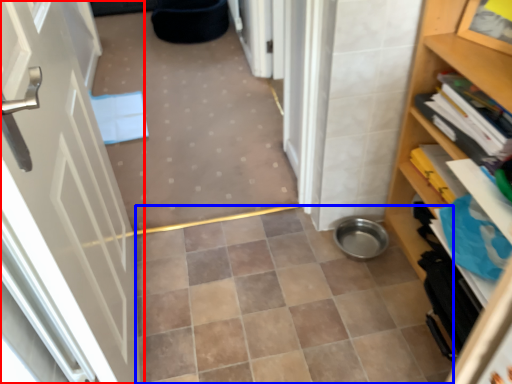
Question: Which object is further to the camera taking this photo, door (highlighted by a red box) or ceramic tile (highlighted by a blue box)?

Choices:
 (A) door
 (B) ceramic tile

Answer: (B)